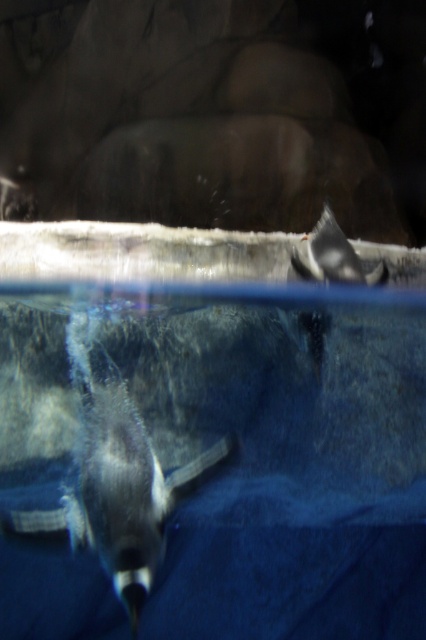
Is point (75, 506) in front of point (328, 269)?

Yes, point (75, 506) is in front of point (328, 269).

Between shiny black penguin at lower left and white matte penguin at upper right, which one appears on the left side from the viewer's perspective?

shiny black penguin at lower left

Does point (77, 384) come behind point (340, 269)?

No, it is in front of (340, 269).

Identify the location of shiny black penguin at lower left. The width and height of the screenshot is (426, 640). (118, 472).